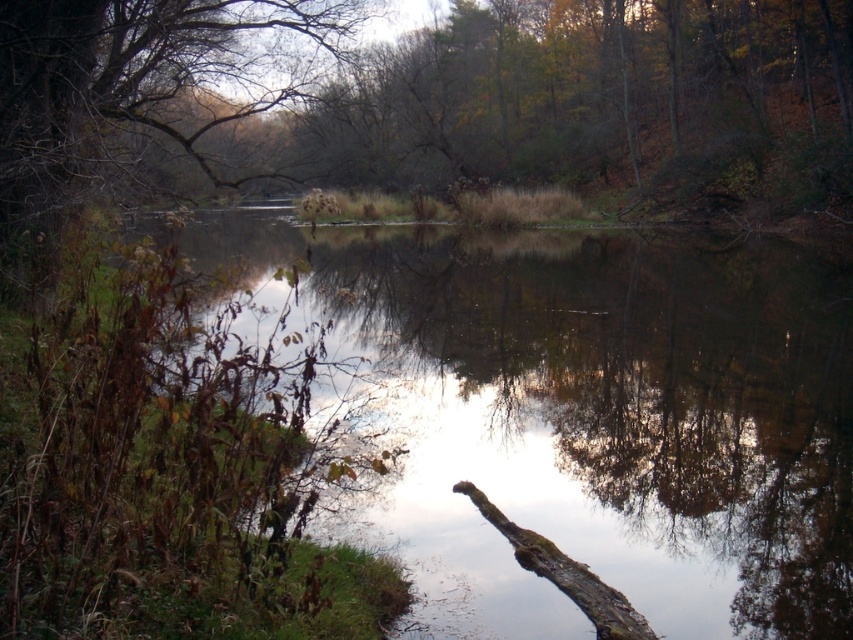
Question: Estimate the real-world distances between objects in this image. Which object is farther from the green mossy log at lower left?

Choices:
 (A) brown leafless branches at upper left
 (B) brown rough tree trunk at lower center

Answer: (B)

Question: Can you confirm if green mossy log at lower left is positioned to the left of brown leafless branches at upper left?

Choices:
 (A) no
 (B) yes

Answer: (A)

Question: Does brown leafless branches at upper left have a greater width compared to brown rough tree trunk at lower center?

Choices:
 (A) yes
 (B) no

Answer: (A)

Question: Which object appears closest to the camera in this image?

Choices:
 (A) brown rough tree trunk at lower center
 (B) brown leafless branches at upper left
 (C) green mossy log at lower left

Answer: (C)

Question: Is green mossy log at lower left closer to camera compared to brown rough tree trunk at lower center?

Choices:
 (A) yes
 (B) no

Answer: (A)

Question: Among these points, which one is farthest from the camera?

Choices:
 (A) (843, 560)
 (B) (268, 90)

Answer: (B)